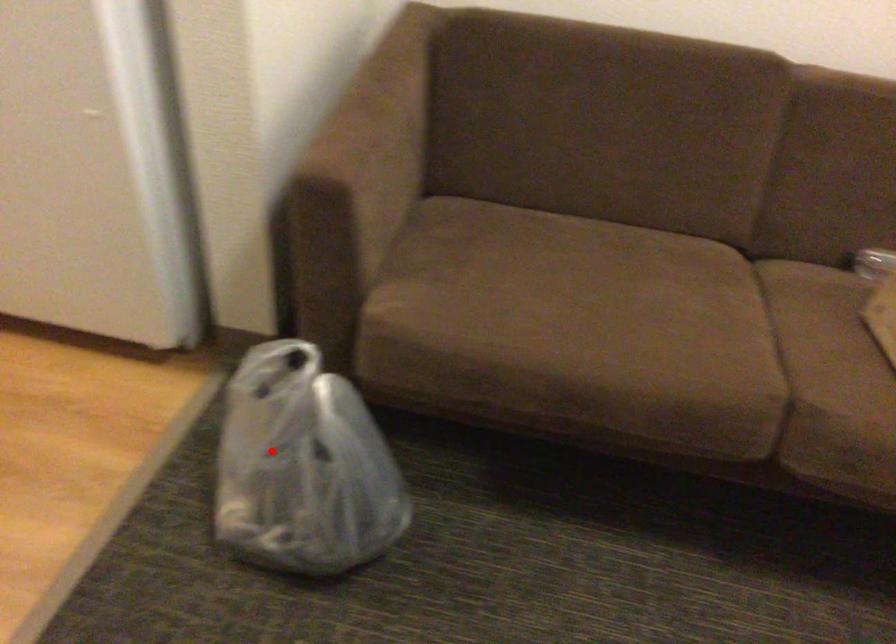
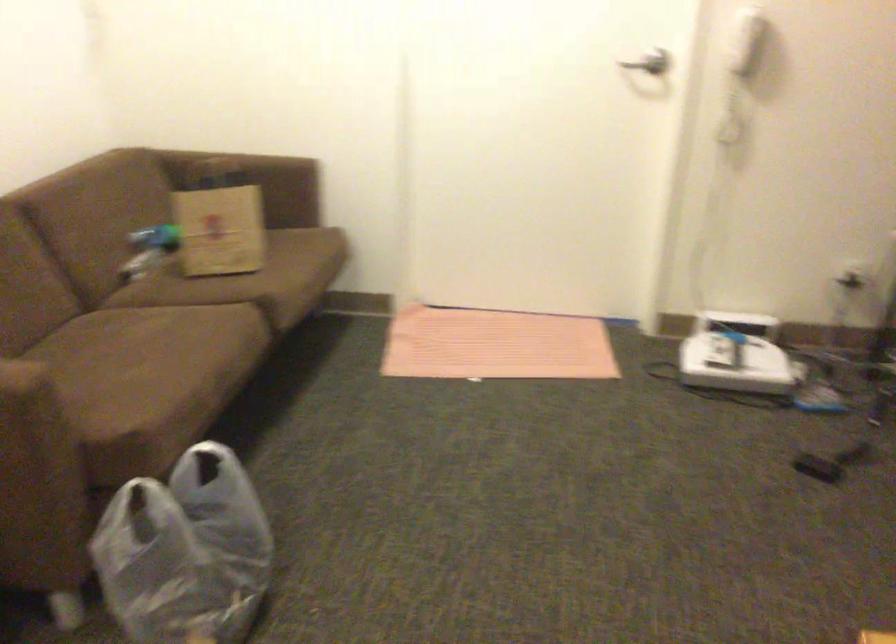
Where in the second image is the point corresponding to the highlighted location from the first image?

(167, 571)